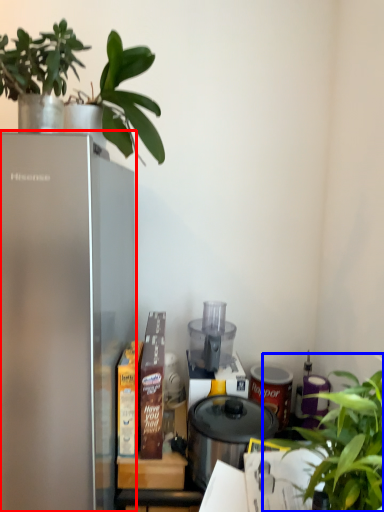
Question: Among these objects, which one is nearest to the camera, refrigerator (highlighted by a red box) or houseplant (highlighted by a blue box)?

Choices:
 (A) refrigerator
 (B) houseplant

Answer: (B)